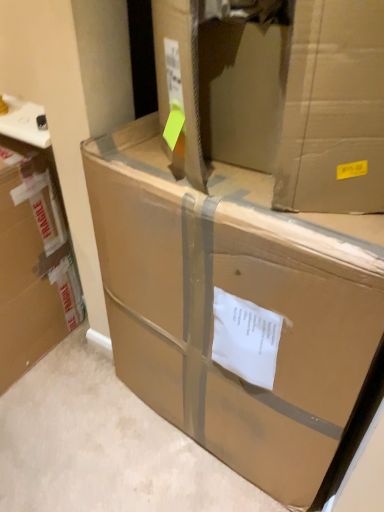
The height and width of the screenshot is (512, 384). What do you see at coordinates (33, 262) in the screenshot?
I see `brown cardboard box at left, positioned as the second box in right-to-left order` at bounding box center [33, 262].

Where is `brown cardboard box at left, positioned as the second box in right-to-left order`? brown cardboard box at left, positioned as the second box in right-to-left order is located at coordinates (33, 262).

Find the location of a particular element. The width and height of the screenshot is (384, 512). brown cardboard box at center, which ranks as the 1th box in right-to-left order is located at coordinates (240, 303).

The height and width of the screenshot is (512, 384). What do you see at coordinates (240, 303) in the screenshot?
I see `brown cardboard box at center, which ranks as the 1th box in right-to-left order` at bounding box center [240, 303].

At what (x,y) coordinates should I click in order to perform the action: click on brown cardboard box at left, positioned as the second box in right-to-left order. Please return your answer as a coordinate pair (x, y). Image resolution: width=384 pixels, height=512 pixels. Looking at the image, I should click on (33, 262).

Based on their positions, is brown cardboard box at center, which is the 2th box from left to right, located to the left or right of brown cardboard box at left, positioned as the second box in right-to-left order?

Based on their positions, brown cardboard box at center, which is the 2th box from left to right, is located to the right of brown cardboard box at left, positioned as the second box in right-to-left order.

Who is more distant, brown cardboard box at center, which ranks as the 1th box in right-to-left order, or brown cardboard box at left, which is the first box from left to right?

brown cardboard box at left, which is the first box from left to right, is more distant.

Is point (242, 204) closer to camera compared to point (44, 240)?

That is True.

From the image's perspective, which one is positioned higher, brown cardboard box at center, which is the 2th box from left to right, or brown cardboard box at left, positioned as the second box in right-to-left order?

From the image's view, brown cardboard box at left, positioned as the second box in right-to-left order, is above.

From a real-world perspective, which object rests below the other?

In real-world perspective, brown cardboard box at left, which is the first box from left to right, is lower.

Considering the sizes of brown cardboard box at center, which is the 2th box from left to right, and brown cardboard box at left, positioned as the second box in right-to-left order, in the image, is brown cardboard box at center, which is the 2th box from left to right, wider or thinner than brown cardboard box at left, positioned as the second box in right-to-left order,?

brown cardboard box at center, which is the 2th box from left to right, is wider than brown cardboard box at left, positioned as the second box in right-to-left order.

Which of these two, brown cardboard box at center, which is the 2th box from left to right, or brown cardboard box at left, positioned as the second box in right-to-left order, stands shorter?

brown cardboard box at left, positioned as the second box in right-to-left order, is shorter.

Consider the image. Based on their sizes in the image, would you say brown cardboard box at center, which is the 2th box from left to right, is bigger or smaller than brown cardboard box at left, which is the first box from left to right?

Considering their sizes, brown cardboard box at center, which is the 2th box from left to right, takes up more space than brown cardboard box at left, which is the first box from left to right.

Is brown cardboard box at center, which is the 2th box from left to right, not within brown cardboard box at left, which is the first box from left to right?

Absolutely, brown cardboard box at center, which is the 2th box from left to right, is external to brown cardboard box at left, which is the first box from left to right.

Are brown cardboard box at center, which ranks as the 1th box in right-to-left order, and brown cardboard box at left, positioned as the second box in right-to-left order, located far from each other?

That's not correct — brown cardboard box at center, which ranks as the 1th box in right-to-left order, is a little close to brown cardboard box at left, positioned as the second box in right-to-left order.

From the picture: Could you tell me if brown cardboard box at center, which is the 2th box from left to right, is turned towards brown cardboard box at left, positioned as the second box in right-to-left order?

No, brown cardboard box at center, which is the 2th box from left to right, is not facing towards brown cardboard box at left, positioned as the second box in right-to-left order.

How different are the orientations of brown cardboard box at center, which is the 2th box from left to right, and brown cardboard box at left, positioned as the second box in right-to-left order, in degrees?

There is a 5.85-degree angle between the facing directions of brown cardboard box at center, which is the 2th box from left to right, and brown cardboard box at left, positioned as the second box in right-to-left order.

Identify the location of box above the brown cardboard box at center, which is the 2th box from left to right (from the image's perspective). This screenshot has height=512, width=384. (33, 262).

Based on their positions, is brown cardboard box at left, positioned as the second box in right-to-left order, located to the left or right of brown cardboard box at center, which ranks as the 1th box in right-to-left order?

In the image, brown cardboard box at left, positioned as the second box in right-to-left order, appears on the left side of brown cardboard box at center, which ranks as the 1th box in right-to-left order.

Considering the positions of objects brown cardboard box at left, positioned as the second box in right-to-left order, and brown cardboard box at center, which ranks as the 1th box in right-to-left order, in the image provided, who is behind, brown cardboard box at left, positioned as the second box in right-to-left order, or brown cardboard box at center, which ranks as the 1th box in right-to-left order,?

brown cardboard box at left, positioned as the second box in right-to-left order, is more distant.

Which point is more forward, (21, 229) or (195, 223)?

The point (195, 223) is in front.

From the image's perspective, is brown cardboard box at left, which is the first box from left to right, under brown cardboard box at center, which is the 2th box from left to right?

No, from the image's perspective, brown cardboard box at left, which is the first box from left to right, is not below brown cardboard box at center, which is the 2th box from left to right.

From a real-world perspective, is brown cardboard box at left, which is the first box from left to right, located beneath brown cardboard box at center, which is the 2th box from left to right?

Yes, from a real-world perspective, brown cardboard box at left, which is the first box from left to right, is under brown cardboard box at center, which is the 2th box from left to right.

Does brown cardboard box at left, which is the first box from left to right, have a greater width compared to brown cardboard box at center, which is the 2th box from left to right?

In fact, brown cardboard box at left, which is the first box from left to right, might be narrower than brown cardboard box at center, which is the 2th box from left to right.

In the scene shown: Is brown cardboard box at left, positioned as the second box in right-to-left order, taller than brown cardboard box at center, which is the 2th box from left to right?

No, brown cardboard box at left, positioned as the second box in right-to-left order, is not taller than brown cardboard box at center, which is the 2th box from left to right.

Considering the sizes of objects brown cardboard box at left, positioned as the second box in right-to-left order, and brown cardboard box at center, which ranks as the 1th box in right-to-left order, in the image provided, who is smaller, brown cardboard box at left, positioned as the second box in right-to-left order, or brown cardboard box at center, which ranks as the 1th box in right-to-left order,?

brown cardboard box at left, positioned as the second box in right-to-left order, is smaller.

Looking at this image, is brown cardboard box at left, which is the first box from left to right, located outside brown cardboard box at center, which is the 2th box from left to right?

Indeed, brown cardboard box at left, which is the first box from left to right, is completely outside brown cardboard box at center, which is the 2th box from left to right.

Are brown cardboard box at left, which is the first box from left to right, and brown cardboard box at center, which is the 2th box from left to right, far apart?

No, brown cardboard box at left, which is the first box from left to right, is not far away from brown cardboard box at center, which is the 2th box from left to right.

Based on the photo, could you tell me if brown cardboard box at left, which is the first box from left to right, is turned towards brown cardboard box at center, which ranks as the 1th box in right-to-left order?

No, brown cardboard box at left, which is the first box from left to right, is not facing towards brown cardboard box at center, which ranks as the 1th box in right-to-left order.

How many degrees apart are the facing directions of brown cardboard box at left, positioned as the second box in right-to-left order, and brown cardboard box at center, which ranks as the 1th box in right-to-left order?

The angle between the facing direction of brown cardboard box at left, positioned as the second box in right-to-left order, and the facing direction of brown cardboard box at center, which ranks as the 1th box in right-to-left order, is 5.85 degrees.

Where is `box below the brown cardboard box at center, which ranks as the 1th box in right-to-left order (from a real-world perspective)`? The image size is (384, 512). box below the brown cardboard box at center, which ranks as the 1th box in right-to-left order (from a real-world perspective) is located at coordinates (33, 262).

In the image, there is a brown cardboard box at center, which is the 2th box from left to right. At what (x,y) coordinates should I click in order to perform the action: click on box below it (from a real-world perspective). Please return your answer as a coordinate pair (x, y). The width and height of the screenshot is (384, 512). Looking at the image, I should click on (33, 262).

You are a GUI agent. You are given a task and a screenshot of the screen. Output one action in this format:
    pyautogui.click(x=<x>, y=<y>)
    Task: Click on the box behind the brown cardboard box at center, which ranks as the 1th box in right-to-left order
    
    Given the screenshot: What is the action you would take?
    click(33, 262)